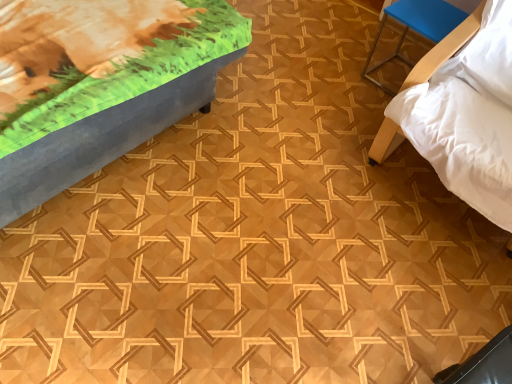
You are a GUI agent. You are given a task and a screenshot of the screen. Output one action in this format:
    pyautogui.click(x=<x>, y=<y>)
    Task: Click on the vacant space that's between blue plastic stool at upper right, marked as the second furniture in a left-to-right arrangement, and white soft bed at right, the 3th furniture from the left
    This screenshot has height=384, width=512.
    Given the screenshot: What is the action you would take?
    pyautogui.click(x=362, y=117)